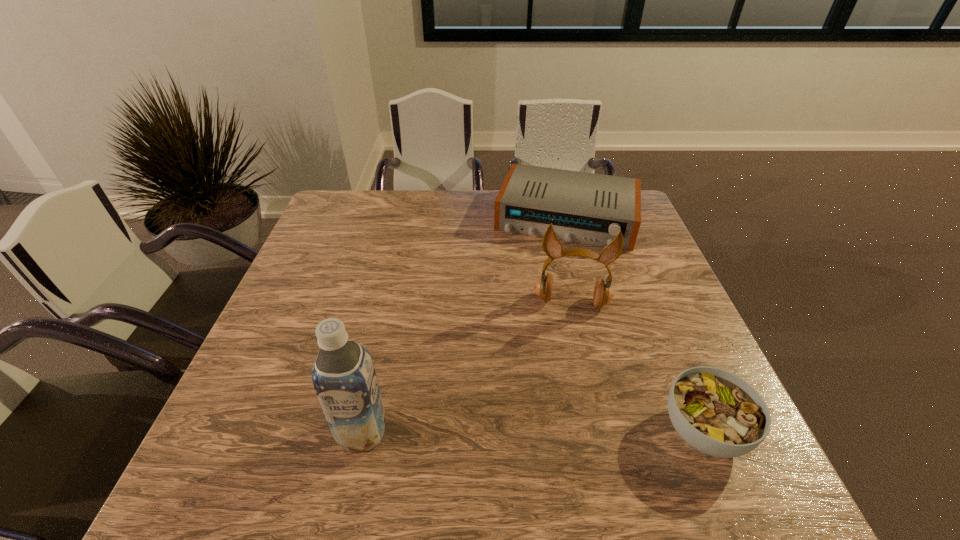
Where is `vacant space positioned on the control panel of the farthest object`? vacant space positioned on the control panel of the farthest object is located at coordinates (533, 340).

Where is `blank space located on the control panel of the farthest object`? The image size is (960, 540). blank space located on the control panel of the farthest object is located at coordinates point(547,280).

You are a GUI agent. You are given a task and a screenshot of the screen. Output one action in this format:
    pyautogui.click(x=<x>, y=<y>)
    Task: Click on the vacant space located on the control panel of the farthest object
    The image size is (960, 540).
    Given the screenshot: What is the action you would take?
    pyautogui.click(x=549, y=273)

Where is `object that is at the far edge`? This screenshot has width=960, height=540. object that is at the far edge is located at coordinates (589, 208).

I want to click on soya milk that is at the near edge, so [x=344, y=378].

At what (x,y) coordinates should I click in order to perform the action: click on soup bowl at the near edge. Please return your answer as a coordinate pair (x, y). The image size is (960, 540). Looking at the image, I should click on (716, 412).

Locate an element on the screen. This screenshot has height=540, width=960. soup bowl positioned at the right edge is located at coordinates (716, 412).

At what (x,y) coordinates should I click in order to perform the action: click on radio receiver that is at the right edge. Please return your answer as a coordinate pair (x, y). This screenshot has height=540, width=960. Looking at the image, I should click on (589, 208).

At what (x,y) coordinates should I click in order to perform the action: click on object that is positioned at the far right corner. Please return your answer as a coordinate pair (x, y). Image resolution: width=960 pixels, height=540 pixels. Looking at the image, I should click on (589, 208).

Where is `object at the near right corner`? The image size is (960, 540). object at the near right corner is located at coordinates [x=716, y=412].